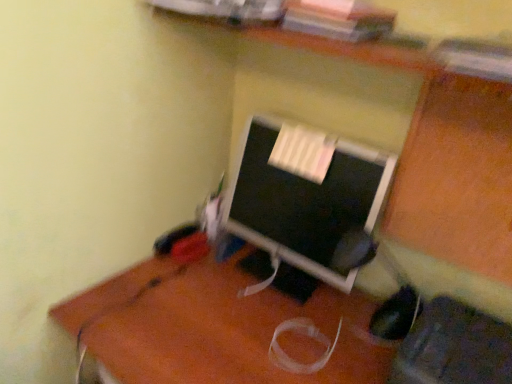
The width and height of the screenshot is (512, 384). In order to click on matte black monitor at center in this screenshot , I will do `click(305, 195)`.

Where is `matte black monitor at center`? The height and width of the screenshot is (384, 512). matte black monitor at center is located at coordinates (305, 195).

Which of these two, matte black monitor at center or brown wooden desk at center, is smaller?

Answer: Smaller between the two is matte black monitor at center.

Is matte black monitor at center wider than brown wooden desk at center?

Incorrect, the width of matte black monitor at center does not surpass that of brown wooden desk at center.

Could matte black monitor at center be considered to be inside black fabric computer chair at lower right?

No, matte black monitor at center is not a part of black fabric computer chair at lower right.

From a real-world perspective, is black fabric computer chair at lower right physically located above or below matte black monitor at center?

In terms of real-world spatial position, black fabric computer chair at lower right is below matte black monitor at center.

Does black fabric computer chair at lower right touch matte black monitor at center?

black fabric computer chair at lower right and matte black monitor at center are not in contact.

Locate an element on the screen. computer chair below the matte black monitor at center (from the image's perspective) is located at coordinates (454, 347).

Which of these two, brown wooden desk at center or matte black monitor at center, is thinner?

matte black monitor at center is thinner.

From the image's perspective, is brown wooden desk at center beneath matte black monitor at center?

Correct, brown wooden desk at center appears lower than matte black monitor at center in the image.

Is matte black monitor at center a part of brown wooden desk at center?

No.

Does brown wooden desk at center lie in front of matte black monitor at center?

That is True.

Which object is wider, black fabric computer chair at lower right or brown wooden desk at center?

With larger width is brown wooden desk at center.

Does point (456, 344) lie in front of point (196, 265)?

Yes, it is in front of point (196, 265).

From the image's perspective, is black fabric computer chair at lower right located above or below brown wooden desk at center?

Clearly, from the image's perspective, black fabric computer chair at lower right is above brown wooden desk at center.

Who is smaller, black fabric computer chair at lower right or brown wooden desk at center?

With smaller size is black fabric computer chair at lower right.

Between matte black monitor at center and black fabric computer chair at lower right, which one is positioned in front?

black fabric computer chair at lower right is in front.

Considering the sizes of objects matte black monitor at center and black fabric computer chair at lower right in the image provided, who is shorter, matte black monitor at center or black fabric computer chair at lower right?

With less height is black fabric computer chair at lower right.

Is matte black monitor at center thinner than black fabric computer chair at lower right?

Yes, matte black monitor at center is thinner than black fabric computer chair at lower right.

You are a GUI agent. You are given a task and a screenshot of the screen. Output one action in this format:
    pyautogui.click(x=<x>, y=<y>)
    Task: Click on the computer chair that is on the right side of matte black monitor at center
    The width and height of the screenshot is (512, 384).
    Given the screenshot: What is the action you would take?
    [454, 347]

Does brown wooden desk at center have a greater height compared to black fabric computer chair at lower right?

Yes.

Considering the relative sizes of brown wooden desk at center and black fabric computer chair at lower right in the image provided, is brown wooden desk at center bigger than black fabric computer chair at lower right?

Indeed, brown wooden desk at center has a larger size compared to black fabric computer chair at lower right.

Which object is thinner, brown wooden desk at center or black fabric computer chair at lower right?

black fabric computer chair at lower right is thinner.

The width and height of the screenshot is (512, 384). Identify the location of desk that is under the matte black monitor at center (from a real-world perspective). (222, 330).

Find the location of a particular element. This screenshot has height=384, width=512. computer monitor behind the black fabric computer chair at lower right is located at coordinates (305, 195).

Which object lies nearer to the anchor point matte black monitor at center, black fabric computer chair at lower right or brown wooden desk at center?

brown wooden desk at center.

When comparing their distances from black fabric computer chair at lower right, does matte black monitor at center or brown wooden desk at center seem closer?

brown wooden desk at center is positioned closer to the anchor black fabric computer chair at lower right.

Estimate the real-world distances between objects in this image. Which object is further from black fabric computer chair at lower right, brown wooden desk at center or matte black monitor at center?

matte black monitor at center is positioned further to the anchor black fabric computer chair at lower right.

Looking at the image, which one is located further to matte black monitor at center, brown wooden desk at center or black fabric computer chair at lower right?

black fabric computer chair at lower right lies further to matte black monitor at center than the other object.

Based on their spatial positions, is black fabric computer chair at lower right or matte black monitor at center closer to brown wooden desk at center?

The object closer to brown wooden desk at center is matte black monitor at center.

Considering their positions, is matte black monitor at center positioned further to brown wooden desk at center than black fabric computer chair at lower right?

black fabric computer chair at lower right is positioned further to the anchor brown wooden desk at center.

Find the location of a particular element. The width and height of the screenshot is (512, 384). computer chair between matte black monitor at center and brown wooden desk at center in the vertical direction is located at coordinates (454, 347).